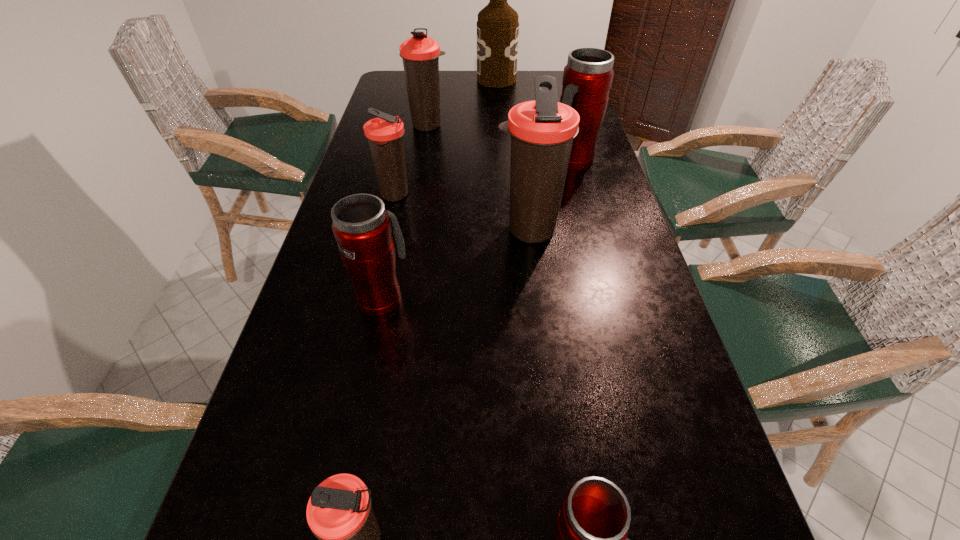
Image resolution: width=960 pixels, height=540 pixels. What are the coordinates of `free area in between the third smallest brown thermos bottle and the fifth nearest thermos bottle` in the screenshot? It's located at (412, 160).

Locate an element on the screen. Image resolution: width=960 pixels, height=540 pixels. vacant area that lies between the biggest brown thermos bottle and the third smallest brown thermos bottle is located at coordinates (479, 178).

Locate an element on the screen. This screenshot has width=960, height=540. vacant area that lies between the second smallest red thermos bottle and the biggest red thermos bottle is located at coordinates (477, 230).

Identify which object is the fifth closest to the alcohol. Please provide its 2D coordinates. Your answer should be formatted as a tuple, i.e. [(x, y)], where the tuple contains the x and y coordinates of a point satisfying the conditions above.

[(362, 227)]

I want to click on the second closest object to the rightmost brown thermos bottle, so click(x=362, y=227).

Identify which thermos bottle is the sixth closest to the nearest brown thermos bottle. Please provide its 2D coordinates. Your answer should be formatted as a tuple, i.e. [(x, y)], where the tuple contains the x and y coordinates of a point satisfying the conditions above.

[(420, 54)]

At what (x,y) coordinates should I click in order to perform the action: click on thermos bottle that is the second closest to the leftmost red thermos bottle. Please return your answer as a coordinate pair (x, y). Looking at the image, I should click on (384, 134).

What are the coordinates of `brown thermos bottle that can be found as the closest to the rightmost brown thermos bottle` in the screenshot? It's located at (384, 134).

Find the location of `the second closest brown thermos bottle relative to the smallest brown thermos bottle`. the second closest brown thermos bottle relative to the smallest brown thermos bottle is located at coordinates (384, 134).

Locate an element on the screen. This screenshot has width=960, height=540. red thermos bottle that is the closest one to the seventh nearest object is located at coordinates (587, 78).